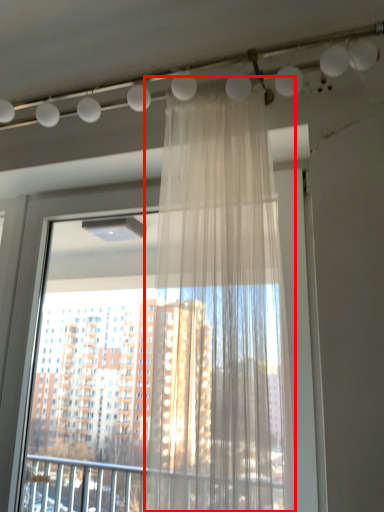
Question: Observing the image, what is the correct spatial positioning of curtain (annotated by the red box) in reference to window?

Choices:
 (A) right
 (B) left

Answer: (A)